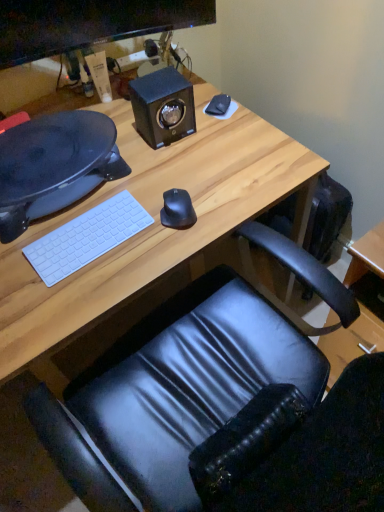
This screenshot has width=384, height=512. In order to click on vacant space situated above white matte keyboard at lower left (from a real-world perspective) in this screenshot , I will do `click(87, 231)`.